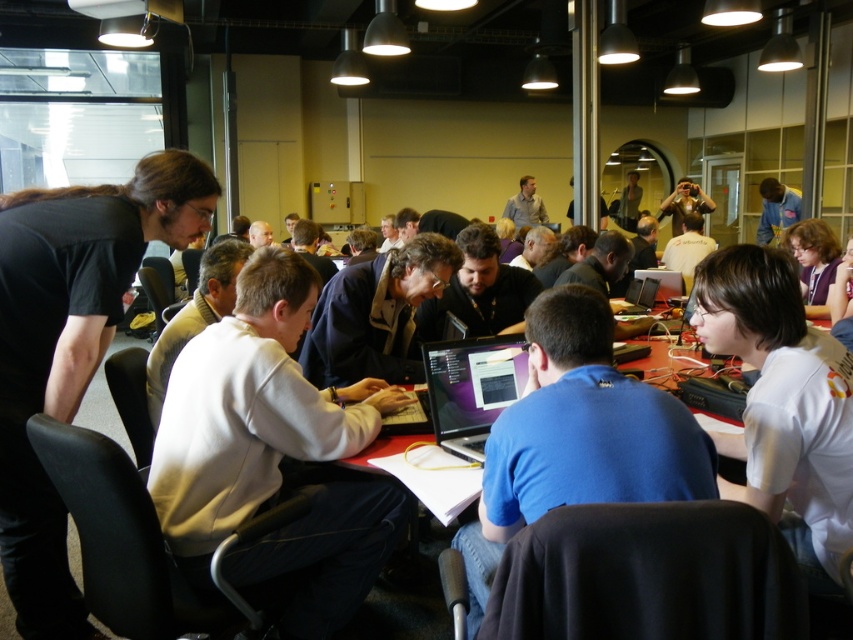
Who is taller, white cotton shirt at lower right or matte black shirt at upper right?

matte black shirt at upper right is taller.

Is white cotton shirt at lower right positioned before matte black shirt at upper right?

That is True.

Which is behind, point (714, 301) or point (776, 236)?

Point (776, 236)

I want to click on white cotton shirt at lower right, so click(x=782, y=404).

How distant is blue cotton shirt at center from red matte table at center?

blue cotton shirt at center and red matte table at center are 29.08 inches apart.

Consider the image. Does blue cotton shirt at center have a greater width compared to red matte table at center?

Indeed, blue cotton shirt at center has a greater width compared to red matte table at center.

Locate an element on the screen. This screenshot has height=640, width=853. blue cotton shirt at center is located at coordinates (577, 436).

Does white cotton shirt at lower right appear under silver metallic laptop at center?

Yes, white cotton shirt at lower right is below silver metallic laptop at center.

Between point (788, 321) and point (643, 292), which one is positioned in front?

Point (788, 321)

Where is `white cotton shirt at lower right`? white cotton shirt at lower right is located at coordinates (782, 404).